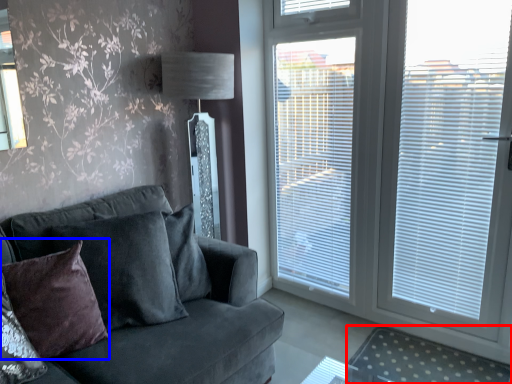
Question: Which object is closer to the camera taking this photo, plain (highlighted by a red box) or pillow (highlighted by a blue box)?

Choices:
 (A) plain
 (B) pillow

Answer: (B)